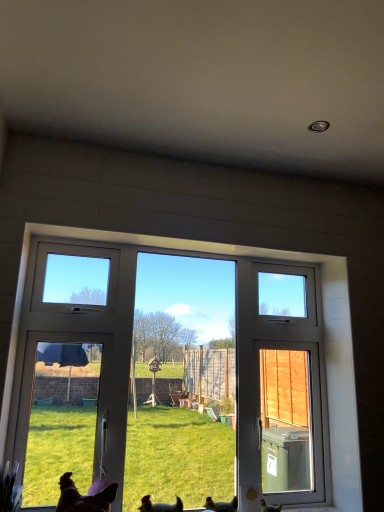
Question: Considering the relative positions of brown matte chicken at lower right, the 1th chicken when ordered from right to left, and brown fur dog at lower left, the 2th dog positioned from the right, in the image provided, is brown matte chicken at lower right, the 1th chicken when ordered from right to left, to the left or to the right of brown fur dog at lower left, the 2th dog positioned from the right,?

Choices:
 (A) left
 (B) right

Answer: (B)

Question: Looking at their shapes, would you say brown matte chicken at lower right, the 1th chicken when ordered from right to left, is wider or thinner than brown fur dog at lower left, the 2th dog positioned from the right?

Choices:
 (A) thin
 (B) wide

Answer: (A)

Question: Which of these objects is positioned farthest from the white plastic window at center?

Choices:
 (A) brown feathered chicken at lower center, the 2th chicken from the right
 (B) brown fur dog at lower center, which is the second dog from left to right
 (C) brown matte chicken at lower right, the second chicken in the left-to-right sequence
 (D) brown fur dog at lower left, which is counted as the first dog, starting from the left

Answer: (B)

Question: Estimate the real-world distances between objects in this image. Which object is farther from the brown fur dog at lower left, the 2th dog positioned from the right?

Choices:
 (A) white plastic window at center
 (B) brown feathered chicken at lower center, positioned as the 1th chicken in left-to-right order
 (C) brown fur dog at lower center, the 1th dog positioned from the right
 (D) brown matte chicken at lower right, the second chicken in the left-to-right sequence

Answer: (A)